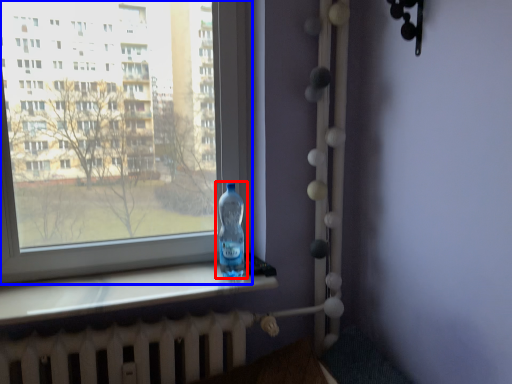
Question: Which object appears farthest to the camera in this image, bottle (highlighted by a red box) or window (highlighted by a blue box)?

Choices:
 (A) bottle
 (B) window

Answer: (A)